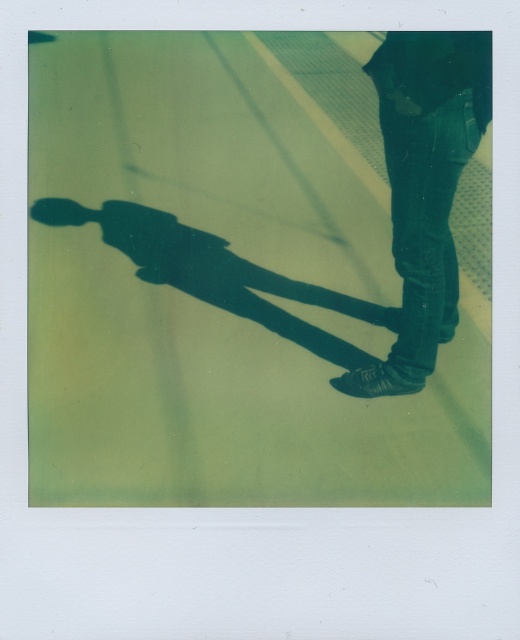
Question: Is green polished concrete at center thinner than jeans at right?

Choices:
 (A) yes
 (B) no

Answer: (B)

Question: Does green polished concrete at center appear on the left side of jeans at right?

Choices:
 (A) no
 (B) yes

Answer: (B)

Question: Can you confirm if green polished concrete at center is thinner than jeans at right?

Choices:
 (A) no
 (B) yes

Answer: (A)

Question: Which object appears closest to the camera in this image?

Choices:
 (A) green polished concrete at center
 (B) jeans at right

Answer: (B)